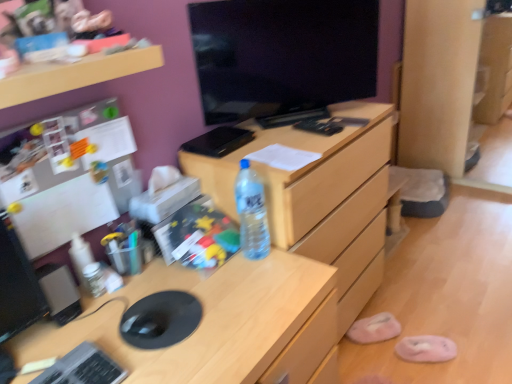
Question: Is pink fuzzy slipper at lower right, the 2th slipper positioned from the left, inside pink fabric slipper at lower right, arranged as the first slipper when viewed from the left?

Choices:
 (A) no
 (B) yes

Answer: (A)

Question: From a real-world perspective, is pink fabric slipper at lower right, acting as the 2th slipper starting from the front, located higher than pink fuzzy slipper at lower right, marked as the second slipper in a back-to-front arrangement?

Choices:
 (A) yes
 (B) no

Answer: (A)

Question: From the image's perspective, is pink fabric slipper at lower right, arranged as the first slipper when viewed from the left, below pink fuzzy slipper at lower right, marked as the second slipper in a back-to-front arrangement?

Choices:
 (A) yes
 (B) no

Answer: (B)

Question: Is pink fabric slipper at lower right, arranged as the first slipper when viewed from the left, facing away from pink fuzzy slipper at lower right, marked as the second slipper in a back-to-front arrangement?

Choices:
 (A) no
 (B) yes

Answer: (A)

Question: Considering the relative positions of pink fabric slipper at lower right, acting as the 2th slipper starting from the front, and pink fuzzy slipper at lower right, the first slipper in the right-to-left sequence, in the image provided, is pink fabric slipper at lower right, acting as the 2th slipper starting from the front, in front of pink fuzzy slipper at lower right, the first slipper in the right-to-left sequence,?

Choices:
 (A) no
 (B) yes

Answer: (A)

Question: In terms of width, does pink fabric slipper at lower right, arranged as the first slipper when viewed from the left, look wider or thinner when compared to clear wood file cabinet at center?

Choices:
 (A) wide
 (B) thin

Answer: (B)

Question: From the image's perspective, relative to clear wood file cabinet at center, is pink fabric slipper at lower right, which appears as the 1th slipper when viewed from the back, above or below?

Choices:
 (A) above
 (B) below

Answer: (B)

Question: In terms of height, does pink fabric slipper at lower right, which appears as the 1th slipper when viewed from the back, look taller or shorter compared to clear wood file cabinet at center?

Choices:
 (A) short
 (B) tall

Answer: (A)

Question: Considering the positions of pink fabric slipper at lower right, which is counted as the 2th slipper, starting from the right, and clear wood file cabinet at center in the image, is pink fabric slipper at lower right, which is counted as the 2th slipper, starting from the right, bigger or smaller than clear wood file cabinet at center?

Choices:
 (A) big
 (B) small

Answer: (B)

Question: Would you say black glossy monitor at center is inside or outside clear wood file cabinet at center?

Choices:
 (A) inside
 (B) outside

Answer: (B)

Question: In terms of size, does black glossy monitor at center appear bigger or smaller than clear wood file cabinet at center?

Choices:
 (A) big
 (B) small

Answer: (B)

Question: From a real-world perspective, is black glossy monitor at center physically located above or below clear wood file cabinet at center?

Choices:
 (A) above
 (B) below

Answer: (A)

Question: Is black glossy monitor at center wider or thinner than clear wood file cabinet at center?

Choices:
 (A) wide
 (B) thin

Answer: (B)

Question: Would you say pink fabric slipper at lower right, which is counted as the 2th slipper, starting from the right, is inside or outside wooden shelf at upper left?

Choices:
 (A) inside
 (B) outside

Answer: (B)

Question: Considering the positions of pink fabric slipper at lower right, arranged as the first slipper when viewed from the left, and wooden shelf at upper left in the image, is pink fabric slipper at lower right, arranged as the first slipper when viewed from the left, taller or shorter than wooden shelf at upper left?

Choices:
 (A) tall
 (B) short

Answer: (A)